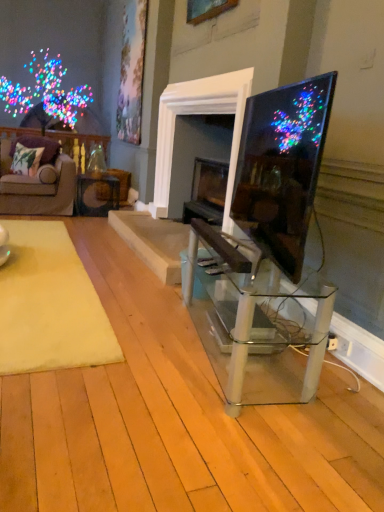
Identify the location of free spot in front of clear glass table at center, positioned as the first table in front-to-back order. (209, 434).